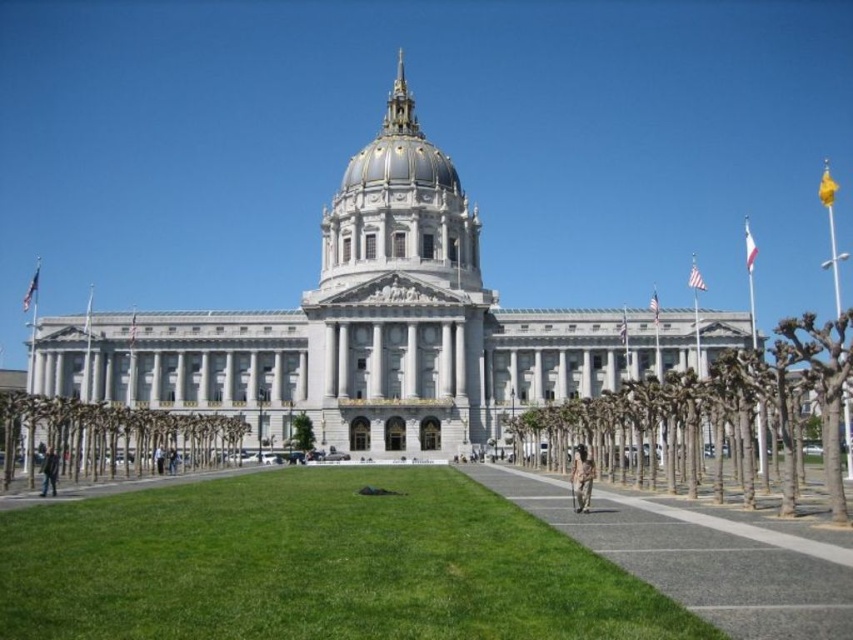
Question: Considering the real-world distances, which object is closest to the green grass at center?

Choices:
 (A) green leafy tree at lower left
 (B) green leafy tree at center
 (C) gold metallic dome at center
 (D) bare branches at center

Answer: (A)

Question: Which object appears farthest from the camera in this image?

Choices:
 (A) green leafy tree at lower left
 (B) gold metallic dome at center
 (C) gray asphalt path at lower center

Answer: (B)

Question: Can you confirm if green grass at center is bigger than green leafy tree at center?

Choices:
 (A) yes
 (B) no

Answer: (A)

Question: Is green grass at center to the left of gold metallic dome at center from the viewer's perspective?

Choices:
 (A) yes
 (B) no

Answer: (A)

Question: Which point is farther from the camera taking this photo?

Choices:
 (A) (76, 445)
 (B) (828, 497)

Answer: (A)

Question: Is green grass at center in front of bare branches at center?

Choices:
 (A) yes
 (B) no

Answer: (A)